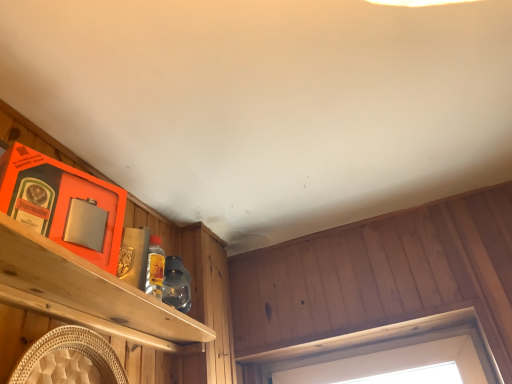
Question: In the image, is brushed metal shelf at left positioned in front of or behind wooden frame at upper center?

Choices:
 (A) behind
 (B) front

Answer: (B)

Question: In terms of height, does brushed metal shelf at left look taller or shorter compared to wooden frame at upper center?

Choices:
 (A) short
 (B) tall

Answer: (B)

Question: Based on their positions, is brushed metal shelf at left located to the left or right of wooden frame at upper center?

Choices:
 (A) right
 (B) left

Answer: (B)

Question: Considering the positions of point (454, 317) and point (170, 336), is point (454, 317) closer or farther from the camera than point (170, 336)?

Choices:
 (A) closer
 (B) farther

Answer: (B)

Question: From a real-world perspective, is wooden frame at upper center above or below brushed metal shelf at left?

Choices:
 (A) below
 (B) above

Answer: (B)

Question: From the image's perspective, relative to brushed metal shelf at left, is wooden frame at upper center above or below?

Choices:
 (A) above
 (B) below

Answer: (B)

Question: Considering the positions of wooden frame at upper center and brushed metal shelf at left in the image, is wooden frame at upper center bigger or smaller than brushed metal shelf at left?

Choices:
 (A) small
 (B) big

Answer: (A)